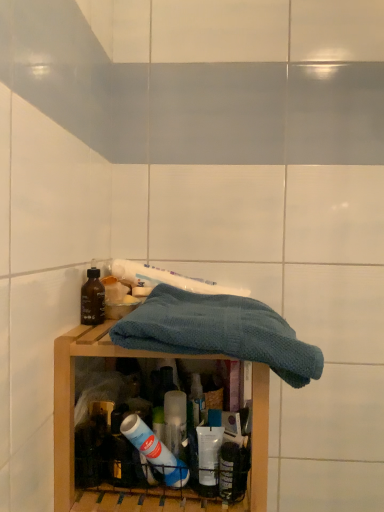
You are a GUI agent. You are given a task and a screenshot of the screen. Output one action in this format:
    pyautogui.click(x=<x>, y=<y>)
    Task: Click on the matte brown bottle at left
    
    Given the screenshot: What is the action you would take?
    pyautogui.click(x=93, y=298)

Is blue knitted towel at center at the back of wooden shelf at center?

No.

Is wooden shelf at center placed right next to blue knitted towel at center?

They are not placed beside each other.

Which object is further away from the camera taking this photo, wooden shelf at center or blue knitted towel at center?

wooden shelf at center is more distant.

Are matte brown bottle at left and blue knitted towel at center far apart?

No.

Considering the relative sizes of matte brown bottle at left and blue knitted towel at center in the image provided, is matte brown bottle at left taller than blue knitted towel at center?

No, matte brown bottle at left is not taller than blue knitted towel at center.

Can we say matte brown bottle at left lies outside blue knitted towel at center?

Yes.

Considering the sizes of matte brown bottle at left and blue knitted towel at center in the image, is matte brown bottle at left wider or thinner than blue knitted towel at center?

matte brown bottle at left is thinner than blue knitted towel at center.

Considering the relative sizes of blue knitted towel at center and wooden shelf at center in the image provided, is blue knitted towel at center smaller than wooden shelf at center?

Correct, blue knitted towel at center occupies less space than wooden shelf at center.

Considering the positions of point (251, 315) and point (73, 361), is point (251, 315) closer or farther from the camera than point (73, 361)?

Clearly, point (251, 315) is more distant from the camera than point (73, 361).

Is wooden shelf at center a part of blue knitted towel at center?

That's incorrect, wooden shelf at center is not inside blue knitted towel at center.

Would you say wooden shelf at center is outside white glossy toothpaste at center?

Yes, wooden shelf at center is outside of white glossy toothpaste at center.

What's the angular difference between wooden shelf at center and white glossy toothpaste at center's facing directions?

They differ by 0.929 degrees in their facing directions.

From the image's perspective, between wooden shelf at center and white glossy toothpaste at center, which one is located above?

white glossy toothpaste at center appears higher in the image.

Is wooden shelf at center oriented away from white glossy toothpaste at center?

wooden shelf at center is not turned away from white glossy toothpaste at center.

Is white glossy toothpaste at center not near wooden shelf at center?

No, there isn't a large distance between white glossy toothpaste at center and wooden shelf at center.

Would you say wooden shelf at center is part of white glossy toothpaste at center's contents?

Definitely not — wooden shelf at center is not inside white glossy toothpaste at center.

Does white glossy toothpaste at center appear on the left side of wooden shelf at center?

No.

Looking at this image, does white glossy toothpaste at center come in front of wooden shelf at center?

That is False.

From the image's perspective, is white glossy toothpaste at center above or below matte brown bottle at left?

From the image's perspective, white glossy toothpaste at center appears above matte brown bottle at left.

From a real-world perspective, is white glossy toothpaste at center positioned under matte brown bottle at left based on gravity?

No, from a real-world perspective, white glossy toothpaste at center is not below matte brown bottle at left.

At what (x,y) coordinates should I click in order to perform the action: click on toothpaste above the matte brown bottle at left (from a real-world perspective). Please return your answer as a coordinate pair (x, y). The width and height of the screenshot is (384, 512). Looking at the image, I should click on (167, 279).

Is matte brown bottle at left taller than white glossy toothpaste at center?

Yes.

Is the surface of matte brown bottle at left in direct contact with white glossy toothpaste at center?

No, matte brown bottle at left is not with white glossy toothpaste at center.

Is matte brown bottle at left smaller than white glossy toothpaste at center?

Correct, matte brown bottle at left occupies less space than white glossy toothpaste at center.

I want to click on bottle that appears below the white glossy toothpaste at center (from a real-world perspective), so click(x=93, y=298).

Where is `towel that appears above the wooden shelf at center (from a real-world perspective)`? towel that appears above the wooden shelf at center (from a real-world perspective) is located at coordinates (219, 332).

This screenshot has height=512, width=384. Find the location of `bottle that is above the blue knitted towel at center (from the image's perspective)`. bottle that is above the blue knitted towel at center (from the image's perspective) is located at coordinates (93, 298).

From the image, which object appears to be nearer to white glossy toothpaste at center, wooden shelf at center or blue knitted towel at center?

Among the two, blue knitted towel at center is located nearer to white glossy toothpaste at center.

Estimate the real-world distances between objects in this image. Which object is closer to blue knitted towel at center, matte brown bottle at left or wooden shelf at center?

wooden shelf at center is closer to blue knitted towel at center.

Looking at the image, which one is located further to wooden shelf at center, white glossy toothpaste at center or matte brown bottle at left?

white glossy toothpaste at center.

Considering their positions, is wooden shelf at center positioned closer to white glossy toothpaste at center than matte brown bottle at left?

matte brown bottle at left lies closer to white glossy toothpaste at center than the other object.

From the image, which object appears to be nearer to blue knitted towel at center, wooden shelf at center or white glossy toothpaste at center?

Based on the image, wooden shelf at center appears to be nearer to blue knitted towel at center.

Considering their positions, is white glossy toothpaste at center positioned further to matte brown bottle at left than wooden shelf at center?

wooden shelf at center is further to matte brown bottle at left.

From the image, which object appears to be farther from matte brown bottle at left, blue knitted towel at center or white glossy toothpaste at center?

Among the two, blue knitted towel at center is located further to matte brown bottle at left.

Based on their spatial positions, is blue knitted towel at center or matte brown bottle at left further from wooden shelf at center?

matte brown bottle at left.

At what (x,y) coordinates should I click in order to perform the action: click on towel that lies between matte brown bottle at left and wooden shelf at center from top to bottom. Please return your answer as a coordinate pair (x, y). The height and width of the screenshot is (512, 384). Looking at the image, I should click on (219, 332).

Where is `bottle between white glossy toothpaste at center and wooden shelf at center in the up-down direction`? This screenshot has width=384, height=512. bottle between white glossy toothpaste at center and wooden shelf at center in the up-down direction is located at coordinates (93, 298).

Image resolution: width=384 pixels, height=512 pixels. I want to click on shelf between blue knitted towel at center and white glossy toothpaste at center in the front-back direction, so click(x=73, y=411).

Image resolution: width=384 pixels, height=512 pixels. Find the location of `bottle between blue knitted towel at center and white glossy toothpaste at center along the z-axis`. bottle between blue knitted towel at center and white glossy toothpaste at center along the z-axis is located at coordinates (93, 298).